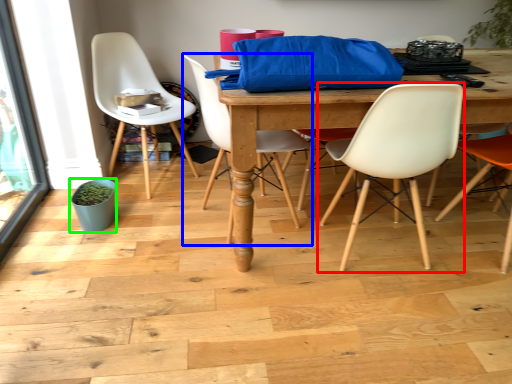
Question: Which is nearer to the chair (highlighted by a red box)? chair (highlighted by a blue box) or flowerpot (highlighted by a green box).

Choices:
 (A) chair
 (B) flowerpot

Answer: (A)